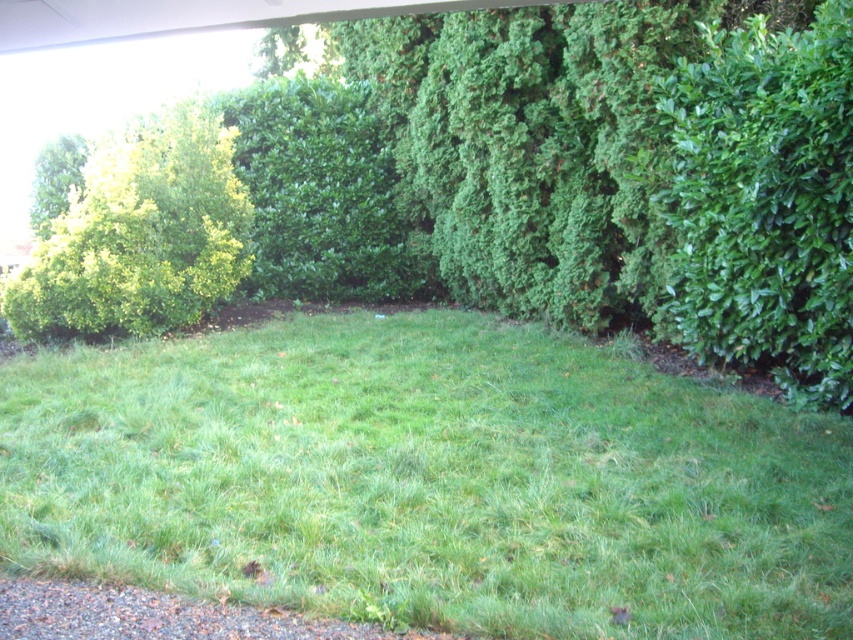
You are a gardener who wants to plant a new bush in this garden. You have two options for placement based on existing bushes. The first option is near the green leafy bush at left, and the second is near the green leafy bush at center. Which location would allow the new bush to have more space to grow, and why?

The green leafy bush at left has a larger size compared to the green leafy bush at center. Therefore, planting the new bush near the green leafy bush at left would provide more space for growth since it already occupies a larger area, indicating that the surrounding space is sufficient to accommodate another bush without overcrowding.

You are a gardener who needs to mow the lawn. You see the green grassy area at center and the green leafy bush at upper right. Which one is shorter and requires mowing?

The green grassy area at center is shorter than the green leafy bush at upper right, so the green grassy area at center requires mowing.

You are a gardener planning to place a 6.5 feet wide decorative stone path between the green leafy bush at left and the green leafy bush at center. Based on the scene, will the path fit between them without overlapping the bushes?

The distance between the green leafy bush at left and the green leafy bush at center is 7.01 feet. Since the path is 6.5 feet wide, it will fit between them with a small gap of 0.51 feet remaining.